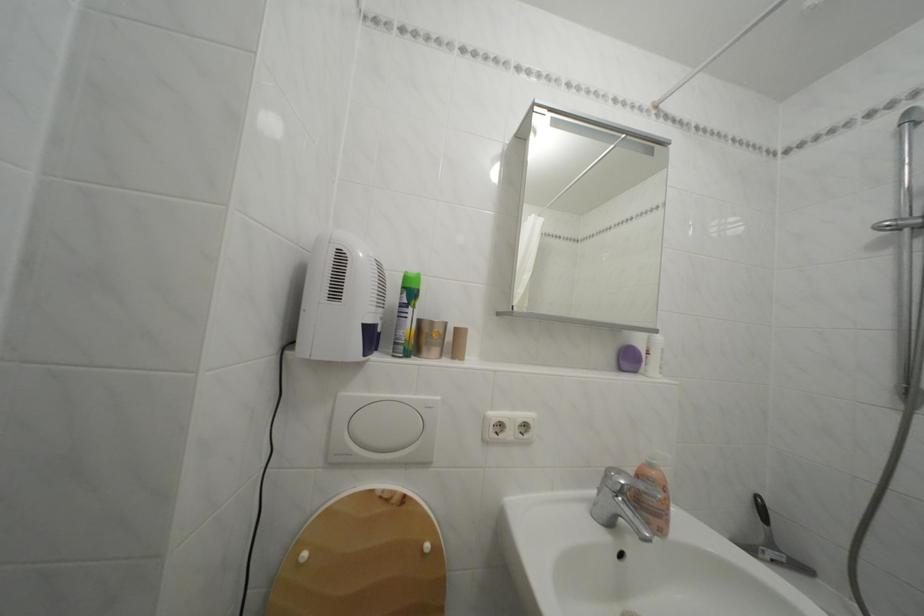
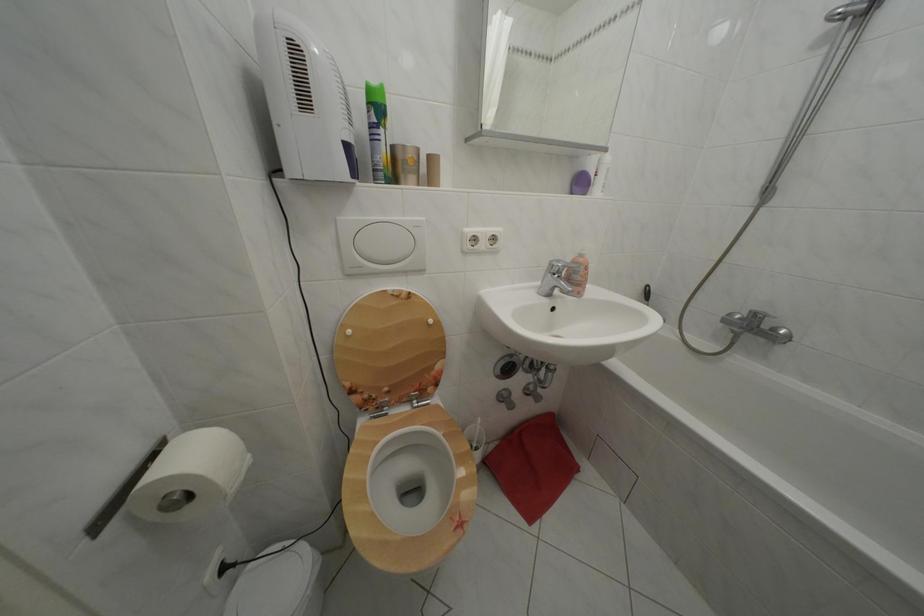
Find the pixel in the second image that matches (x=313, y=561) in the first image.

(358, 338)